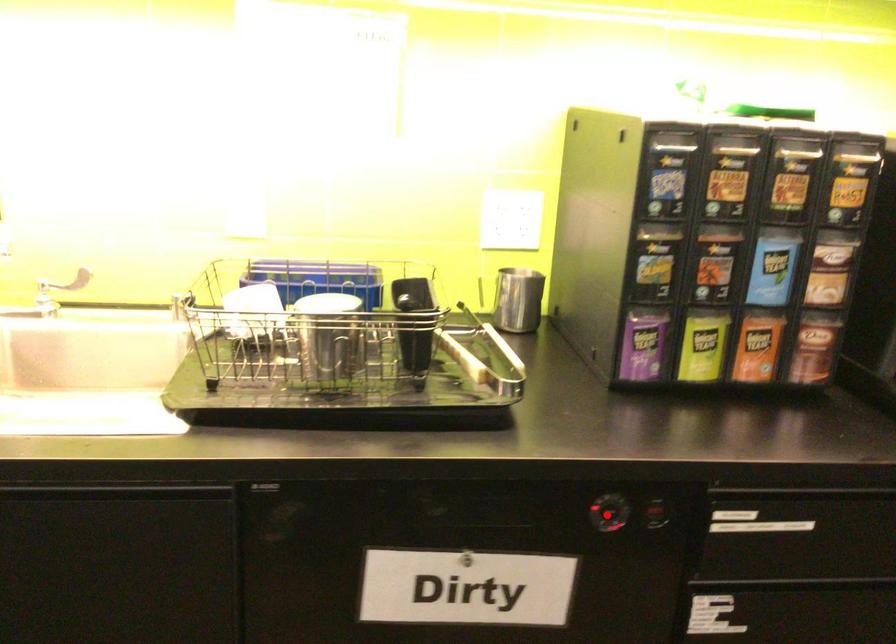
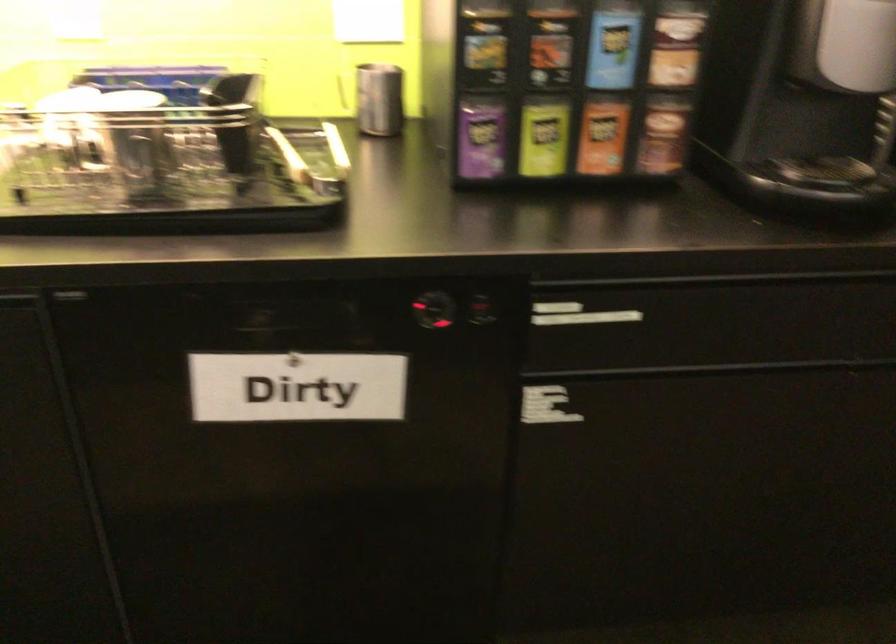
Where in the second image is the point corresponding to the highlighted location from the first image?

(433, 310)